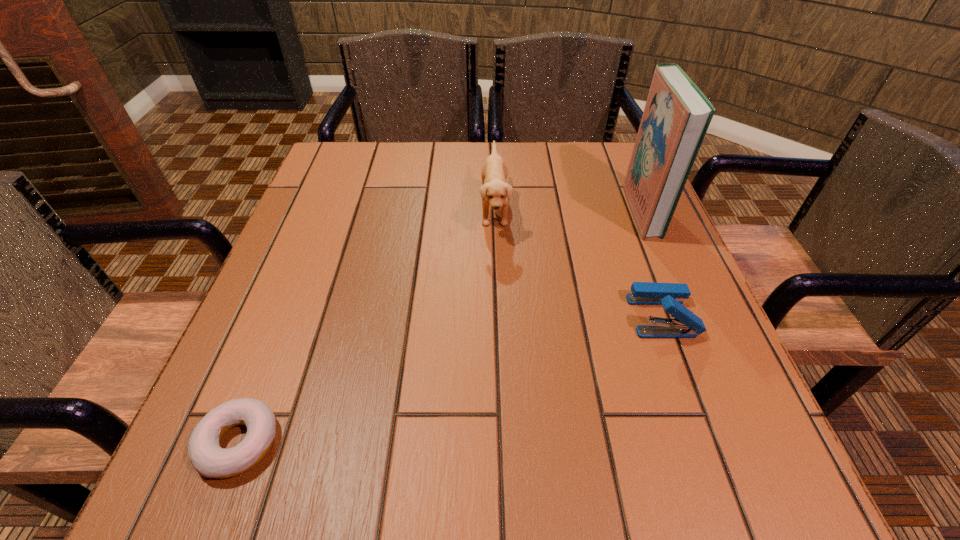
You are a GUI agent. You are given a task and a screenshot of the screen. Output one action in this format:
    pyautogui.click(x=<x>, y=<y>)
    Task: Click on the second closest object relative to the leftmost object
    The image size is (960, 540).
    Given the screenshot: What is the action you would take?
    pyautogui.click(x=686, y=324)

What are the coordinates of `object that is the second closest to the stapler` in the screenshot? It's located at (494, 191).

Where is `free space that satisfies the following two spatial constraints: 1. on the left side of the puppy; 2. on the front side of the nearest object`? This screenshot has width=960, height=540. free space that satisfies the following two spatial constraints: 1. on the left side of the puppy; 2. on the front side of the nearest object is located at coordinates 503,442.

Where is `free space that satisfies the following two spatial constraints: 1. on the back side of the doughnut; 2. on the left side of the stapler`? The image size is (960, 540). free space that satisfies the following two spatial constraints: 1. on the back side of the doughnut; 2. on the left side of the stapler is located at coordinates (288, 316).

Identify the location of free space that satisfies the following two spatial constraints: 1. on the back side of the third tallest object; 2. on the left side of the doughnut. [x=288, y=316].

Identify the location of free spot that satisfies the following two spatial constraints: 1. on the left side of the second tallest object; 2. on the back side of the stapler. This screenshot has width=960, height=540. (498, 316).